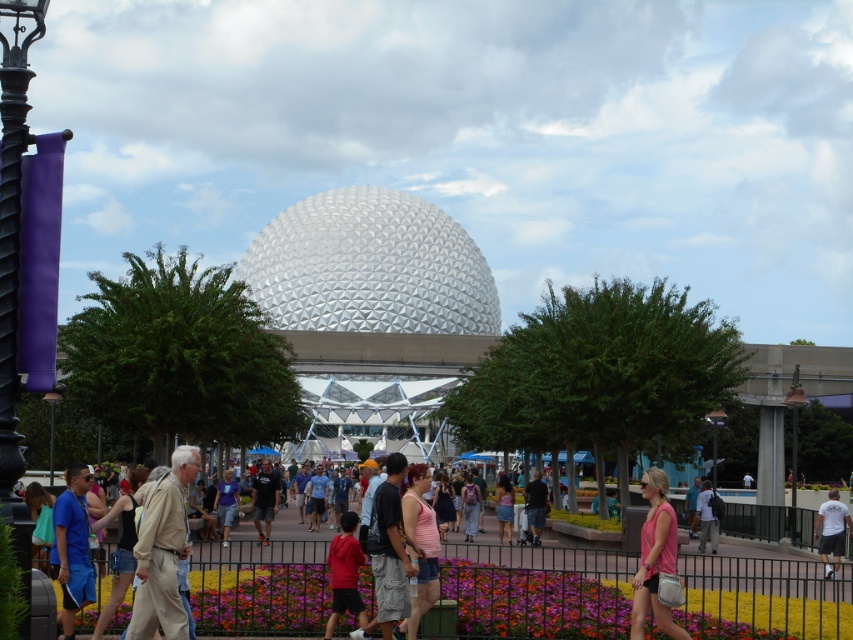
Which is more to the left, beige fabric jacket at lower left or dark blue jeans at center?

beige fabric jacket at lower left

Is point (164, 548) positioned before point (543, 499)?

Yes, it is in front of point (543, 499).

I want to click on beige fabric jacket at lower left, so click(x=161, y=550).

Between beige fabric jacket at lower left and pink fabric tank top at lower right, which one is positioned higher?

Positioned higher is beige fabric jacket at lower left.

Does beige fabric jacket at lower left have a lesser height compared to pink fabric tank top at lower right?

In fact, beige fabric jacket at lower left may be taller than pink fabric tank top at lower right.

Which is behind, point (178, 520) or point (670, 522)?

Positioned behind is point (670, 522).

I want to click on beige fabric jacket at lower left, so click(x=161, y=550).

Between purple fabric flower at lower center and dark blue jeans at center, which one is positioned higher?

dark blue jeans at center

Which is more to the left, purple fabric flower at lower center or dark blue jeans at center?

purple fabric flower at lower center is more to the left.

Image resolution: width=853 pixels, height=640 pixels. What do you see at coordinates (532, 602) in the screenshot?
I see `purple fabric flower at lower center` at bounding box center [532, 602].

Where is `purple fabric flower at lower center`? purple fabric flower at lower center is located at coordinates (532, 602).